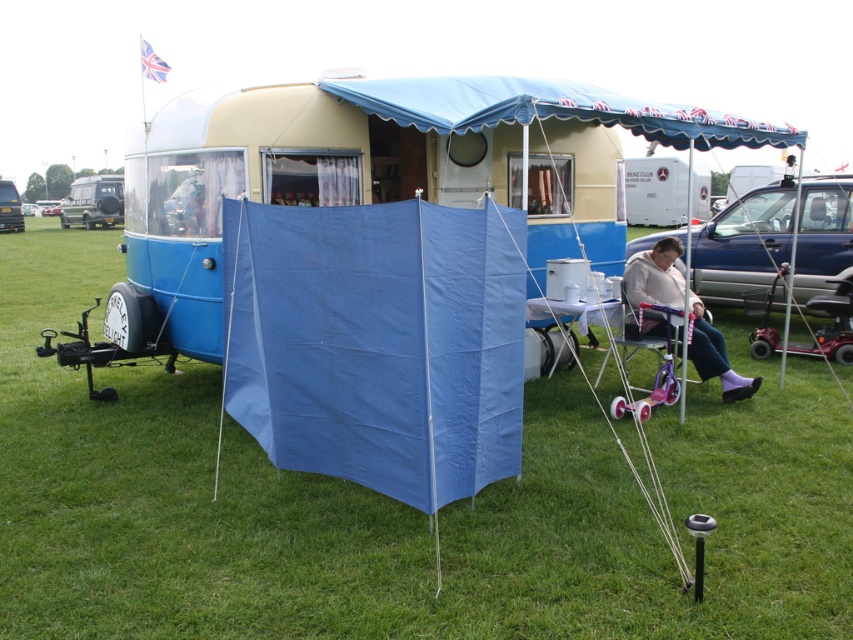
Question: Which of the following is the farthest from the observer?

Choices:
 (A) (22, 220)
 (B) (653, 301)
 (C) (425, 502)
 (D) (100, 179)

Answer: (D)

Question: Which of the following is the farthest from the observer?

Choices:
 (A) white plastic food truck at upper center
 (B) matte blue trailer at center
 (C) metallic blue trailer at left
 (D) light beige sweater at center

Answer: (B)

Question: Is light beige sweater at center bigger than matte blue trailer at center?

Choices:
 (A) yes
 (B) no

Answer: (A)

Question: Estimate the real-world distances between objects in this image. Which object is farther from the metallic blue trailer at left?

Choices:
 (A) light beige sweater at center
 (B) green grass at lower left
 (C) blue fabric trailer at center
 (D) matte blue trailer at center

Answer: (A)

Question: Is white plastic food truck at upper center smaller than metallic blue trailer at left?

Choices:
 (A) no
 (B) yes

Answer: (A)

Question: Does blue fabric tent at center appear on the right side of matte blue trailer at center?

Choices:
 (A) yes
 (B) no

Answer: (A)